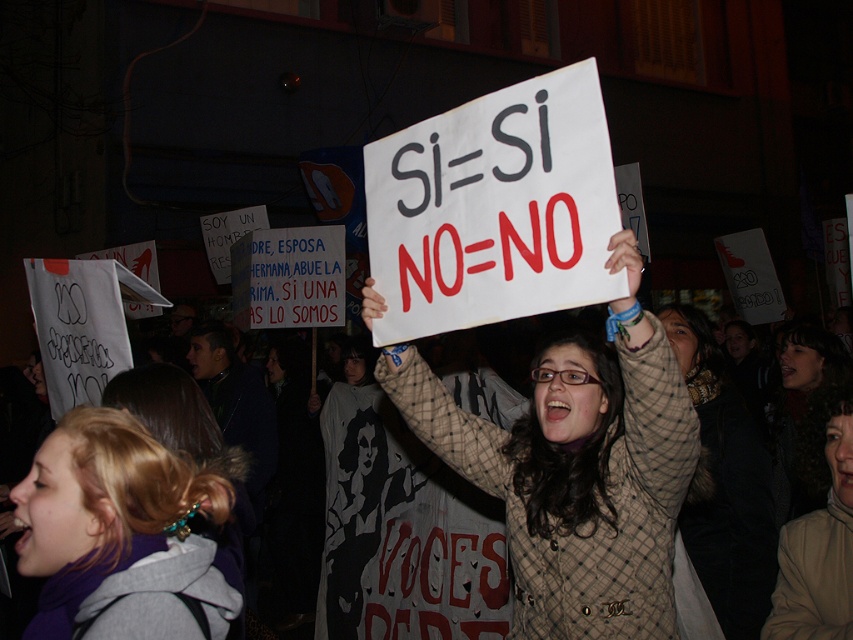
Who is higher up, plaid fabric coat at center or blonde hair at center?

Positioned higher is plaid fabric coat at center.

Does point (630, 541) lie in front of point (126, 573)?

No, it is behind (126, 573).

This screenshot has width=853, height=640. I want to click on plaid fabric coat at center, so click(x=576, y=481).